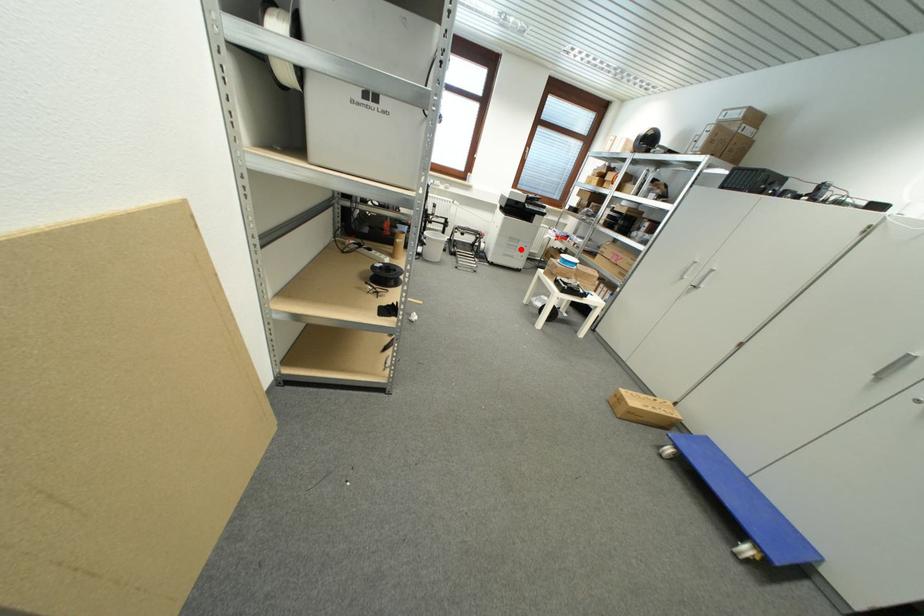
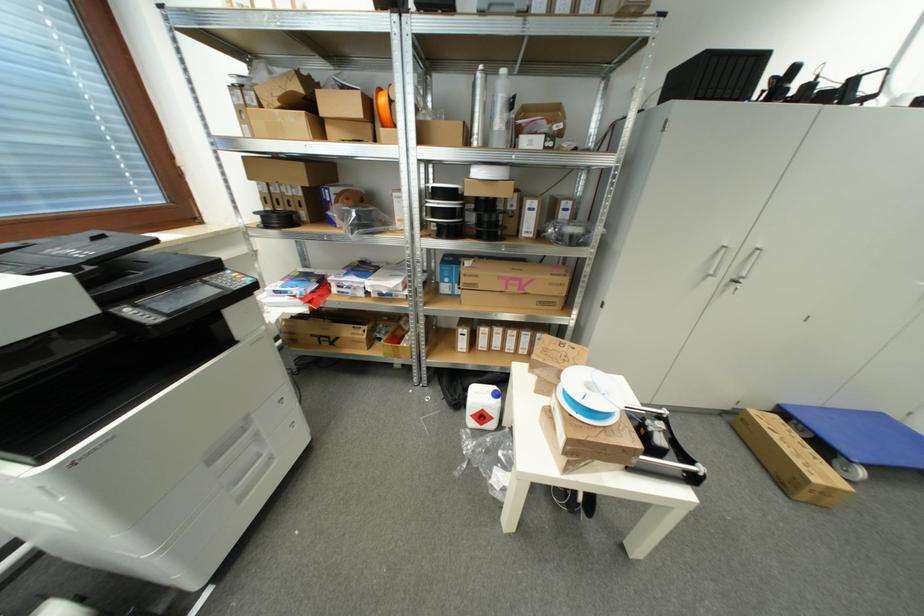
Find the pixel in the second image that matches the highlighted location in the first image.

(261, 438)